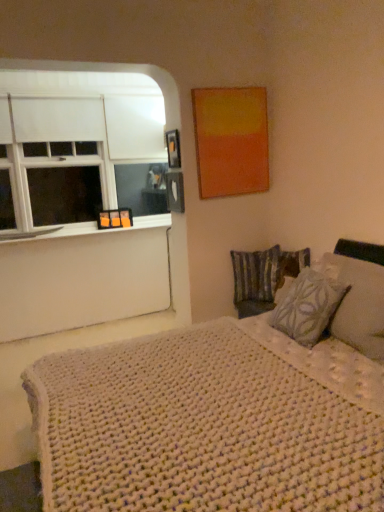
Question: In the image, is patterned fabric pillow at right, marked as the first pillow in a front-to-back arrangement, positioned in front of or behind striped fabric pillow at center-right, the 2th pillow in the front-to-back sequence?

Choices:
 (A) front
 (B) behind

Answer: (A)

Question: From a real-world perspective, relative to striped fabric pillow at center-right, the 2th pillow in the front-to-back sequence, is patterned fabric pillow at right, the 2th pillow when ordered from back to front, vertically above or below?

Choices:
 (A) above
 (B) below

Answer: (A)

Question: Based on their relative distances, which object is nearer to the white painted wood at left?

Choices:
 (A) white knitted blanket at lower right
 (B) white matte window at left
 (C) striped fabric pillow at center-right, the 2th pillow in the front-to-back sequence
 (D) metallic photo frame at upper center
 (E) patterned fabric pillow at right, the 2th pillow when ordered from back to front

Answer: (B)

Question: Which object is positioned farthest from the metallic photo frame at upper center?

Choices:
 (A) white knitted blanket at lower right
 (B) patterned fabric pillow at right, the 2th pillow when ordered from back to front
 (C) white painted wood at left
 (D) white matte window at left
 (E) striped fabric pillow at center-right, arranged as the first pillow when viewed from the back

Answer: (A)